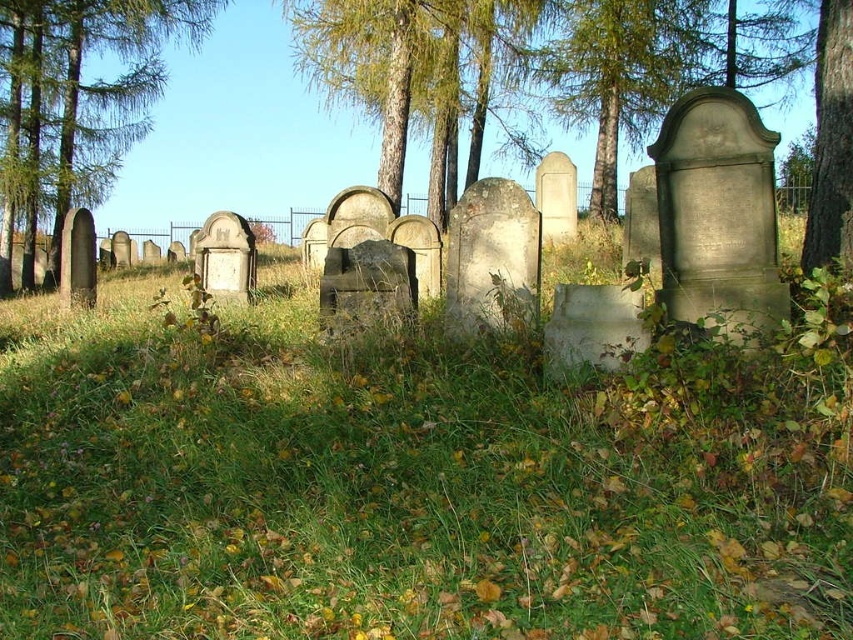
You are standing at the edge of the cemetery looking towards the center. You see a green bark tree at center and a brown rough bark tree at right. Which tree is closer to you?

The green bark tree at center is closer to you because it is positioned over the brown rough bark tree at right, meaning it is in front of it.

You are standing at the center of the cemetery and want to find the green bark tree at center. According to the scene description, where should you look relative to your position?

The green bark tree at center is located at the center of the scene, so you should look straight ahead from your current position at the center of the cemetery.

You are a gardener planning to plant a new tree in the cemetery. You want to ensure it doesn not block the view of the gravestones. Which tree between the green leafy tree at left and the green bark tree at center would be more suitable for this purpose based on their widths?

The green leafy tree at left has a lesser width compared to the green bark tree at center, so it would be more suitable as it won not block the view as much.